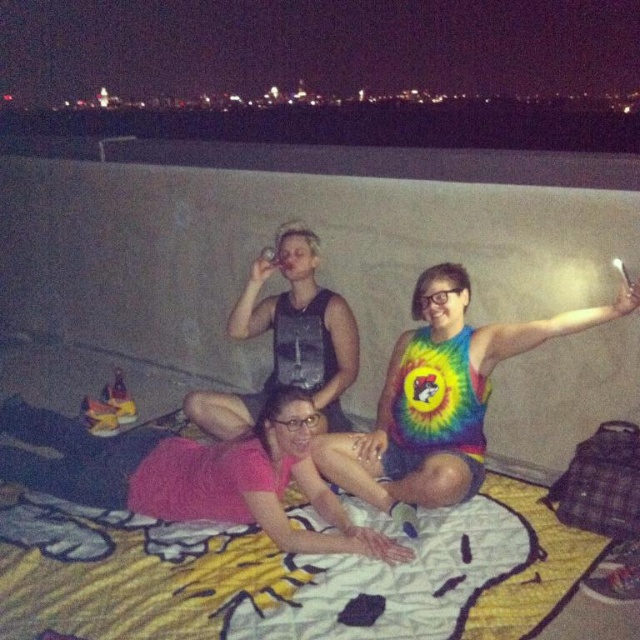
In the scene shown: Does pink satin dress at center have a larger size compared to tie-dye fabric tank top at center?

No, pink satin dress at center is not bigger than tie-dye fabric tank top at center.

Between point (200, 486) and point (412, 410), which one is positioned in front?

Point (200, 486) is more forward.

Between point (150, 492) and point (461, 269), which one is positioned behind?

Positioned behind is point (461, 269).

This screenshot has width=640, height=640. What are the coordinates of `pink satin dress at center` in the screenshot? It's located at (195, 474).